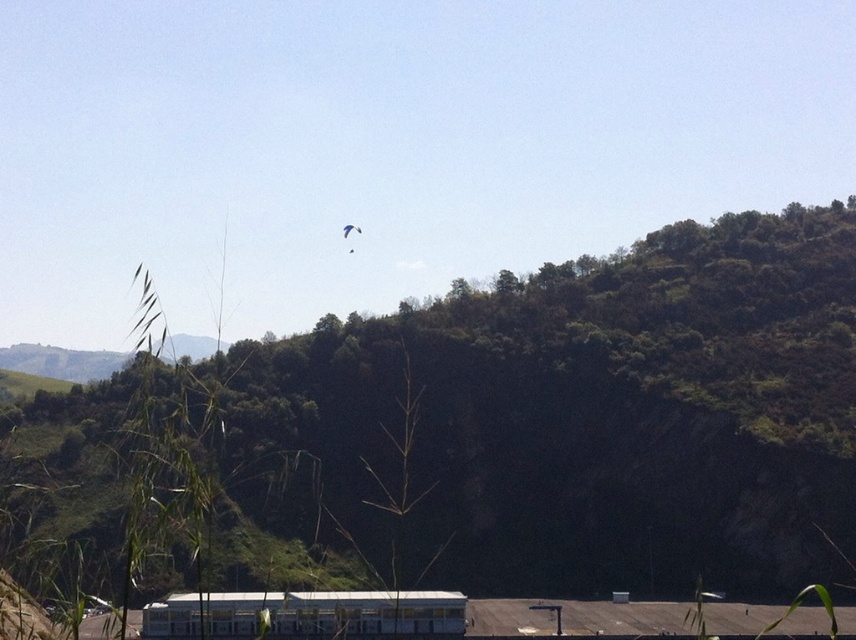
Who is higher up, green leafy tree at upper center or white matte passenger train at lower center?

Positioned higher is green leafy tree at upper center.

Between point (132, 493) and point (203, 611), which one is positioned behind?

Positioned behind is point (203, 611).

I want to click on green leafy tree at upper center, so click(x=500, y=432).